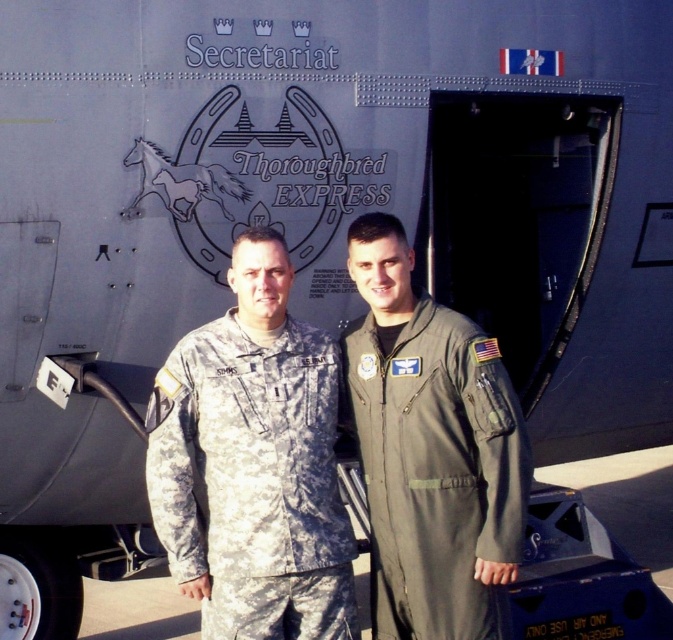
Is camouflage fabric uniform at center behind olive green fabric flight suit at center?

Yes, camouflage fabric uniform at center is behind olive green fabric flight suit at center.

Does point (320, 403) come behind point (450, 632)?

Yes, it is.

Where is `camouflage fabric uniform at center`? The height and width of the screenshot is (640, 673). camouflage fabric uniform at center is located at coordinates (x=252, y=481).

Where is `camouflage fabric uniform at center`? This screenshot has height=640, width=673. camouflage fabric uniform at center is located at coordinates (252, 481).